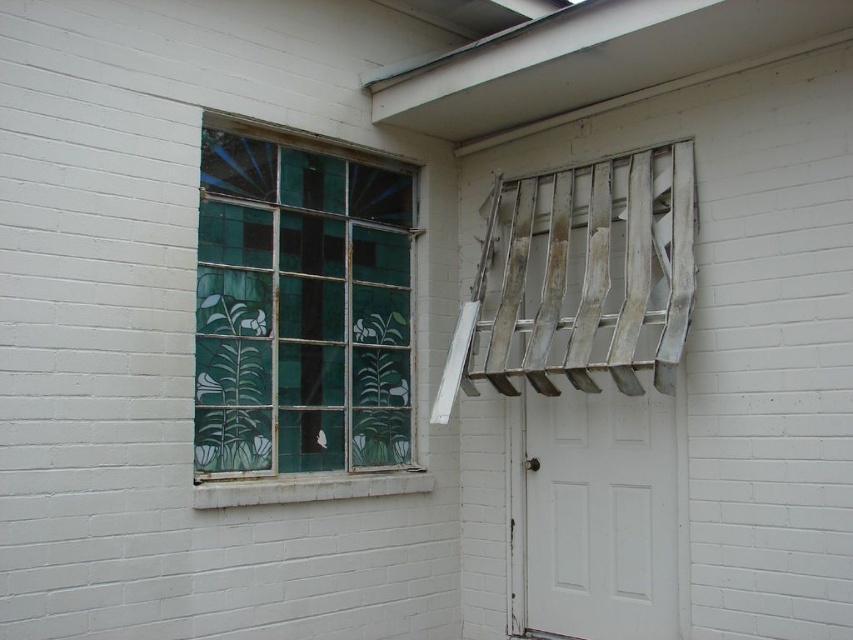
You are standing in front of the building and want to touch both the point at coordinates point (271, 241) and the point at coordinates point (659, 580). Which point will you reach first?

The point at coordinates point (271, 241) will be reached first because it is closer to you than the point at coordinates point (659, 580), which is further away.

You are an architect evaluating the building facade. You need to determine if the green stained glass window at left can accommodate a new decorative panel that requires a space larger than the white matte door at center. Based on the scene description, can the window fit the panel?

The green stained glass window at left is bigger than the white matte door at center, so yes, the window can accommodate the new decorative panel requiring a space larger than the door.